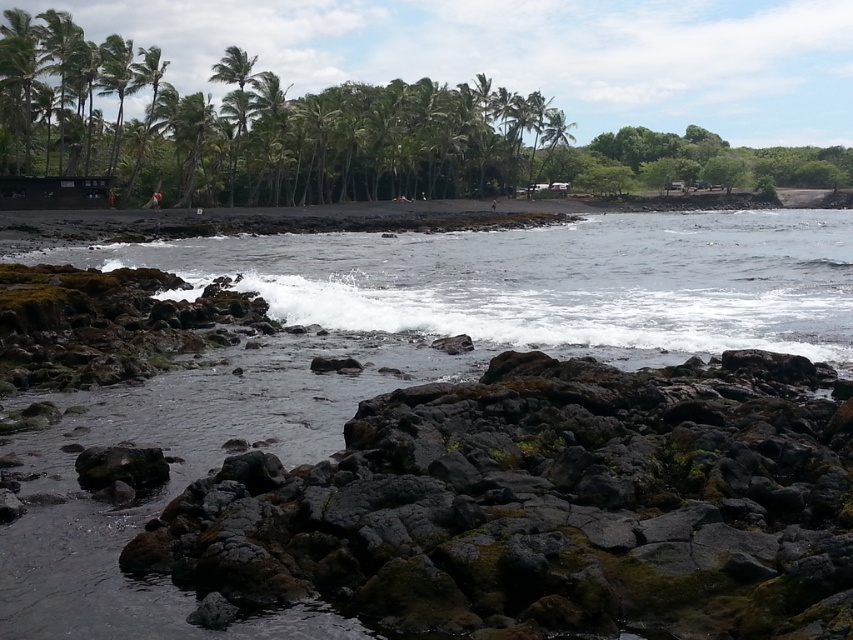
Question: Which of the following is the closest to the observer?

Choices:
 (A) mossy rock at center
 (B) green leafy palm tree at upper left

Answer: (A)

Question: Does mossy rock at center have a smaller size compared to green leafy palm tree at upper left?

Choices:
 (A) yes
 (B) no

Answer: (A)

Question: Does mossy rock at center come in front of green leafy palm tree at upper left?

Choices:
 (A) yes
 (B) no

Answer: (A)

Question: Which point is closer to the camera taking this photo?

Choices:
 (A) (235, 64)
 (B) (276, 522)

Answer: (B)

Question: Is mossy rock at center above green leafy palm tree at upper left?

Choices:
 (A) yes
 (B) no

Answer: (B)